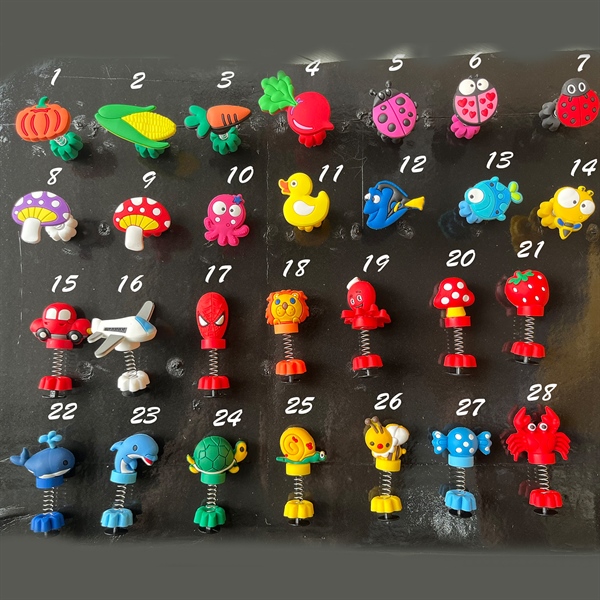
In order to click on first column of toys in this screenshot , I will do `click(49, 114)`, `click(49, 202)`, `click(61, 317)`, `click(54, 460)`.